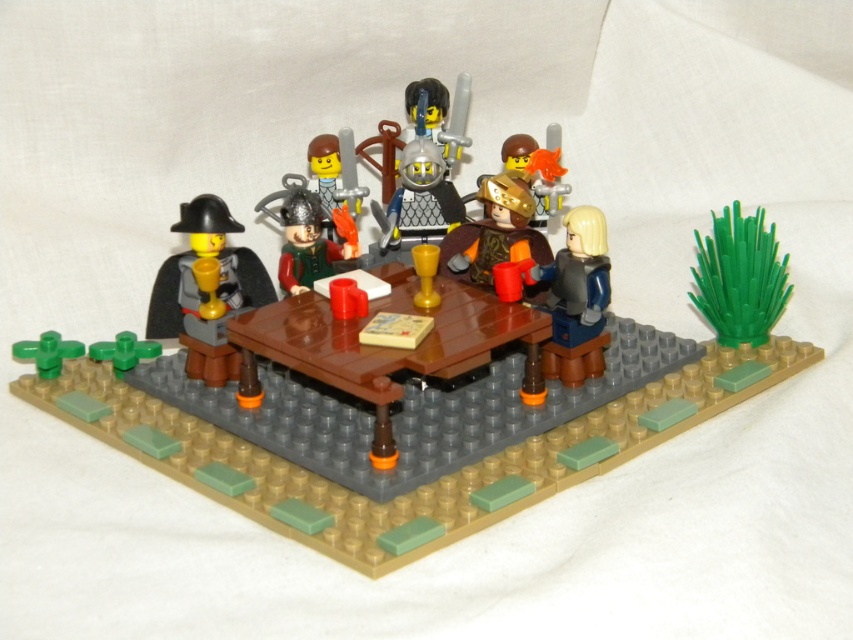
You are a LEGO figure standing at the edge of the table. You see the silver metallic helmet at center and the gold metallic helmet at center. If you want to reach both helmets, which one is closer to you?

The silver metallic helmet at center is closer to you since it is positioned closer to the edge of the table than the gold metallic helmet at center.

You are a LEGO minifigure trying to reach the top of the silver metallic helmet at center and the gold metallic helmet at center. Which helmet will require you to climb higher?

The silver metallic helmet at center is much taller than the gold metallic helmet at center, so you will need to climb higher to reach the top of the silver metallic helmet at center.